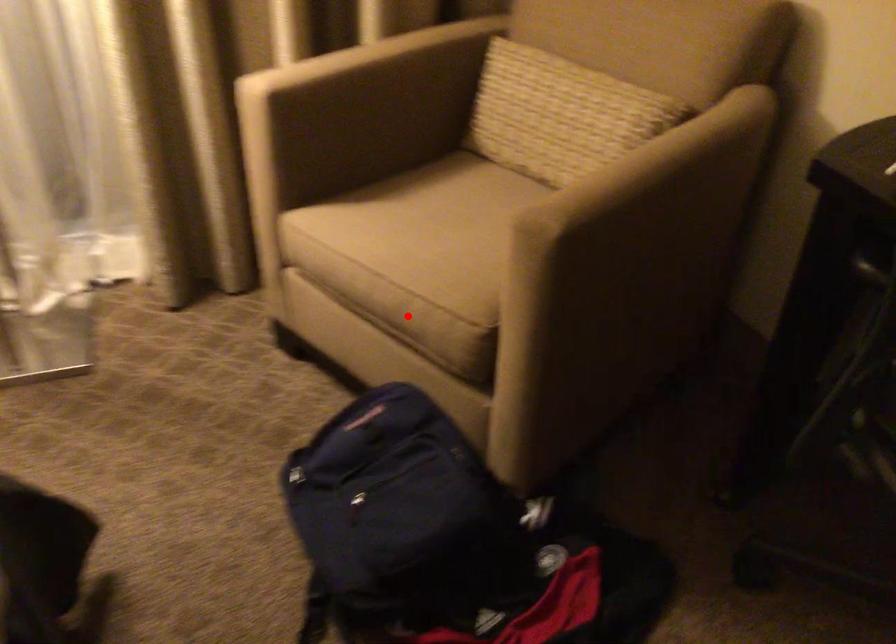
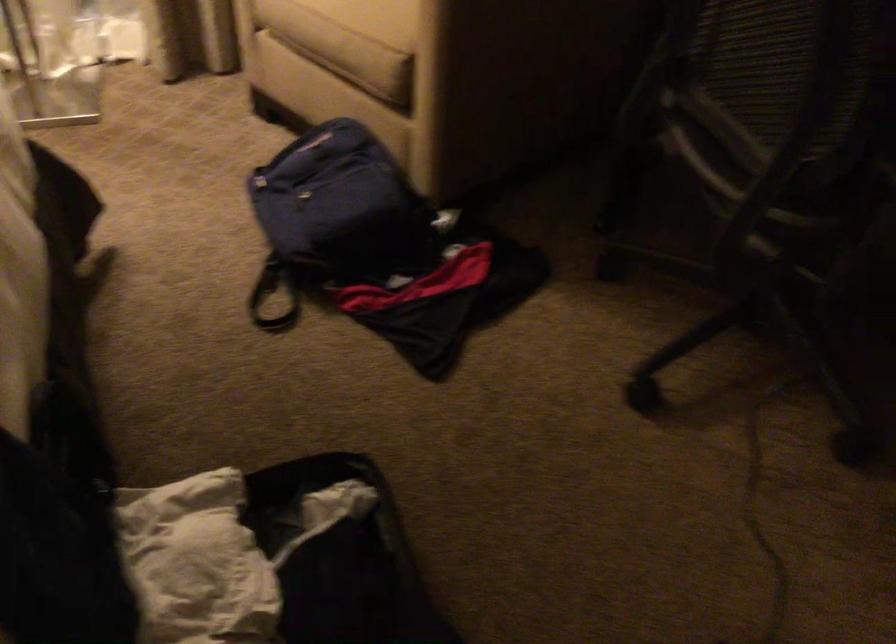
Locate, in the second image, the point that corresponds to the highlighted location in the first image.

(347, 53)